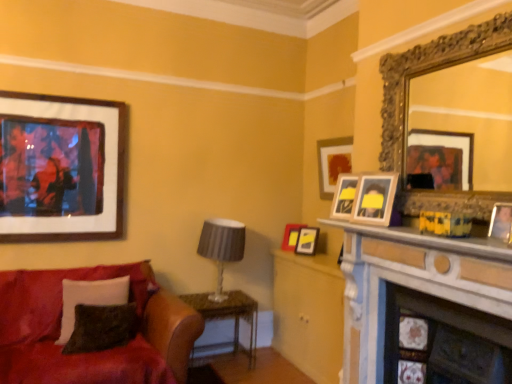
Identify the location of satin red couch at lower left. This screenshot has height=384, width=512. (92, 352).

Where is `wooden photo frame at center, which is counted as the third picture frame, starting from the right`? This screenshot has width=512, height=384. wooden photo frame at center, which is counted as the third picture frame, starting from the right is located at coordinates (375, 199).

Describe the element at coordinates (417, 291) in the screenshot. This screenshot has height=384, width=512. I see `white marble fireplace at center, the 2th fireplace positioned from the bottom` at that location.

The height and width of the screenshot is (384, 512). In order to click on gold ornate mirror at upper right in this screenshot , I will do `click(423, 71)`.

The height and width of the screenshot is (384, 512). What are the coordinates of `marble top table at center` in the screenshot? It's located at (229, 314).

From the image's perspective, is wooden framed artwork at upper left, the first picture frame positioned from the left, above or below gold ornate mirror at upper right?

wooden framed artwork at upper left, the first picture frame positioned from the left, is below gold ornate mirror at upper right.

Does point (74, 233) appear closer or farther from the camera than point (385, 110)?

Point (74, 233).

There is a gold ornate mirror at upper right. At what (x,y) coordinates should I click in order to perform the action: click on the 1st picture frame below it (from the image's perspective). Please return your answer as a coordinate pair (x, y). This screenshot has width=512, height=384. Looking at the image, I should click on (65, 170).

Looking at their sizes, would you say wooden framed artwork at upper left, the fifth picture frame when ordered from right to left, is wider or thinner than gold ornate mirror at upper right?

Clearly, wooden framed artwork at upper left, the fifth picture frame when ordered from right to left, has less width compared to gold ornate mirror at upper right.

Is gold ornate mirror at upper right not within velvet black pillow at lower left, the 2th pillow positioned from the back?

gold ornate mirror at upper right lies outside velvet black pillow at lower left, the 2th pillow positioned from the back,'s area.

From the image's perspective, would you say gold ornate mirror at upper right is positioned over velvet black pillow at lower left, the 2th pillow positioned from the back?

Yes, from the image's perspective, gold ornate mirror at upper right is on top of velvet black pillow at lower left, the 2th pillow positioned from the back.

How much distance is there between gold ornate mirror at upper right and velvet black pillow at lower left, the first pillow from the front?

gold ornate mirror at upper right is 6.99 feet away from velvet black pillow at lower left, the first pillow from the front.

Can you tell me how much gold ornate mirror at upper right and velvet black pillow at lower left, the first pillow from the front, differ in facing direction?

90.4 degrees.

From a real-world perspective, who is located lower, velvet black pillow at lower left, the 2th pillow positioned from the back, or satin red couch at lower left?

In real-world perspective, satin red couch at lower left is lower.

Consider the image. Considering the sizes of velvet black pillow at lower left, the first pillow from the front, and satin red couch at lower left in the image, is velvet black pillow at lower left, the first pillow from the front, wider or thinner than satin red couch at lower left?

velvet black pillow at lower left, the first pillow from the front, is thinner than satin red couch at lower left.

You are a GUI agent. You are given a task and a screenshot of the screen. Output one action in this format:
    pyautogui.click(x=<x>, y=<y>)
    Task: Click on the 1st pillow behind the satin red couch at lower left, counting from the anchor's position
    This screenshot has height=384, width=512.
    Given the screenshot: What is the action you would take?
    pyautogui.click(x=102, y=327)

Is satin red couch at lower left inside velvet black pillow at lower left, the first pillow from the front?

Actually, satin red couch at lower left is outside velvet black pillow at lower left, the first pillow from the front.

From a real-world perspective, between white marble fireplace at center, the 2th fireplace positioned from the bottom, and gold ornate mirror at upper right, who is vertically lower?

white marble fireplace at center, the 2th fireplace positioned from the bottom, is physically lower.

Is gold ornate mirror at upper right completely or partially inside white marble fireplace at center, the 2th fireplace positioned from the bottom?

No, gold ornate mirror at upper right is not a part of white marble fireplace at center, the 2th fireplace positioned from the bottom.

Considering their positions, is white marble fireplace at center, the 2th fireplace positioned from the bottom, located in front of or behind gold ornate mirror at upper right?

In the image, white marble fireplace at center, the 2th fireplace positioned from the bottom, appears in front of gold ornate mirror at upper right.

From the image's perspective, who appears lower, white marble fireplace at center, the 2th fireplace positioned from the bottom, or gold ornate mirror at upper right?

white marble fireplace at center, the 2th fireplace positioned from the bottom, from the image's perspective.

From the image's perspective, count 2nd fireplaces upward from the satin red couch at lower left and point to it. Please provide its 2D coordinates.

[(417, 291)]

Based on the photo, from the image's perspective, is satin red couch at lower left located above or below white marble fireplace at center, the 2th fireplace positioned from the bottom?

satin red couch at lower left is below white marble fireplace at center, the 2th fireplace positioned from the bottom.

Looking at this image, is satin red couch at lower left completely or partially outside of white marble fireplace at center, which is counted as the 1th fireplace, starting from the top?

satin red couch at lower left is positioned outside white marble fireplace at center, which is counted as the 1th fireplace, starting from the top.

Are satin red couch at lower left and white marble fireplace at center, the 2th fireplace positioned from the bottom, located far from each other?

Yes, satin red couch at lower left is far from white marble fireplace at center, the 2th fireplace positioned from the bottom.

From a real-world perspective, which object stands above the other?

From a 3D spatial view, matte gray lampshade at center is above.

Which object is thinner, matte gray lampshade at center or marble fireplace at lower right, which ranks as the first fireplace in bottom-to-top order?

marble fireplace at lower right, which ranks as the first fireplace in bottom-to-top order.

Considering the relative positions of matte gray lampshade at center and marble fireplace at lower right, which ranks as the first fireplace in bottom-to-top order, in the image provided, is matte gray lampshade at center to the left or to the right of marble fireplace at lower right, which ranks as the first fireplace in bottom-to-top order,?

matte gray lampshade at center is positioned on marble fireplace at lower right, which ranks as the first fireplace in bottom-to-top order,'s left side.

Is marble fireplace at lower right, which ranks as the first fireplace in bottom-to-top order, at the back of matte gray lampshade at center?

No, matte gray lampshade at center's orientation is not away from marble fireplace at lower right, which ranks as the first fireplace in bottom-to-top order.

Is point (351, 165) less distant than point (414, 254)?

No, it is behind (414, 254).

How distant is matte wooden picture frame at upper right, placed as the second picture frame when sorted from right to left, from white marble fireplace at center, which is counted as the 1th fireplace, starting from the top?

matte wooden picture frame at upper right, placed as the second picture frame when sorted from right to left, and white marble fireplace at center, which is counted as the 1th fireplace, starting from the top, are 1.39 meters apart from each other.

Considering the sizes of matte wooden picture frame at upper right, placed as the second picture frame when sorted from right to left, and white marble fireplace at center, the 2th fireplace positioned from the bottom, in the image, is matte wooden picture frame at upper right, placed as the second picture frame when sorted from right to left, wider or thinner than white marble fireplace at center, the 2th fireplace positioned from the bottom,?

Clearly, matte wooden picture frame at upper right, placed as the second picture frame when sorted from right to left, has less width compared to white marble fireplace at center, the 2th fireplace positioned from the bottom.

Between matte wooden picture frame at upper right, the 4th picture frame from the front, and white marble fireplace at center, which is counted as the 1th fireplace, starting from the top, which one has more height?

white marble fireplace at center, which is counted as the 1th fireplace, starting from the top, is taller.

Locate an element on the screen. This screenshot has height=384, width=512. the 4th picture frame to the left of the gold ornate mirror at upper right, starting your count from the anchor is located at coordinates (65, 170).

This screenshot has height=384, width=512. What are the coordinates of `mirror lying above the velvet black pillow at lower left, the first pillow from the front (from the image's perspective)` in the screenshot? It's located at (423, 71).

Which object lies nearer to the anchor point wooden framed artwork at upper left, the first picture frame positioned from the left, wooden photo frame at center, which appears as the 2th picture frame when viewed from the front, or matte red picture frame at center, arranged as the first picture frame when viewed from the back?

matte red picture frame at center, arranged as the first picture frame when viewed from the back, is positioned closer to the anchor wooden framed artwork at upper left, the first picture frame positioned from the left.

Based on their spatial positions, is marble fireplace at lower right, which ranks as the first fireplace in bottom-to-top order, or white marble fireplace at center, the 2th fireplace positioned from the bottom, closer to matte gray lampshade at center?

white marble fireplace at center, the 2th fireplace positioned from the bottom, lies closer to matte gray lampshade at center than the other object.

From the image, which object appears to be nearer to gold ornate mirror at upper right, wooden picture frame at right, which is the fifth picture frame in back-to-front order, or matte wooden picture frame at upper right, arranged as the fourth picture frame when viewed from the left?

wooden picture frame at right, which is the fifth picture frame in back-to-front order, is positioned closer to the anchor gold ornate mirror at upper right.

Considering their positions, is marble fireplace at lower right, which ranks as the first fireplace in bottom-to-top order, positioned closer to matte gray lampshade at center than velvety black pillow at lower left, which appears as the second pillow when viewed from the front?

The object closer to matte gray lampshade at center is velvety black pillow at lower left, which appears as the second pillow when viewed from the front.

Considering their positions, is velvet black pillow at lower left, the first pillow from the front, positioned further to marble fireplace at lower right, which ranks as the first fireplace in bottom-to-top order, than matte wooden picture frame at upper right, arranged as the fourth picture frame when viewed from the left?

velvet black pillow at lower left, the first pillow from the front, is further to marble fireplace at lower right, which ranks as the first fireplace in bottom-to-top order.

From the image, which object appears to be nearer to wooden framed artwork at upper left, the fifth picture frame when ordered from right to left, wooden photo frame at center, which appears as the 2th picture frame when viewed from the front, or wooden picture frame at right, which is the fifth picture frame in back-to-front order?

wooden photo frame at center, which appears as the 2th picture frame when viewed from the front, is closer to wooden framed artwork at upper left, the fifth picture frame when ordered from right to left.

Which object lies nearer to the anchor point wooden photo frame at center, which appears as the 2th picture frame when viewed from the front, gold ornate mirror at upper right or matte red picture frame at center, acting as the fourth picture frame starting from the right?

Based on the image, gold ornate mirror at upper right appears to be nearer to wooden photo frame at center, which appears as the 2th picture frame when viewed from the front.

When comparing their distances from velvet black pillow at lower left, the first pillow from the front, does marble fireplace at lower right, which appears as the 2th fireplace when viewed from the top, or white marble fireplace at center, the 2th fireplace positioned from the bottom, seem further?

Based on the image, marble fireplace at lower right, which appears as the 2th fireplace when viewed from the top, appears to be further to velvet black pillow at lower left, the first pillow from the front.

Image resolution: width=512 pixels, height=384 pixels. What are the coordinates of `mirror located between marble fireplace at lower right, which ranks as the first fireplace in bottom-to-top order, and marble top table at center in the depth direction` in the screenshot? It's located at (423, 71).

The width and height of the screenshot is (512, 384). What are the coordinates of `pillow between velvety black pillow at lower left, which appears as the second pillow when viewed from the front, and wooden photo frame at center, which appears as the 2th picture frame when viewed from the front` in the screenshot? It's located at (102, 327).

Where is `pillow between velvety black pillow at lower left, the first pillow viewed from the back, and gold ornate mirror at upper right from left to right`? pillow between velvety black pillow at lower left, the first pillow viewed from the back, and gold ornate mirror at upper right from left to right is located at coordinates (102, 327).

At what (x,y) coordinates should I click in order to perform the action: click on table lamp situated between velvet black pillow at lower left, the 2th pillow positioned from the back, and matte wooden picture frame at upper right, placed as the second picture frame when sorted from right to left, from left to right. Please return your answer as a coordinate pair (x, y). Looking at the image, I should click on (221, 247).